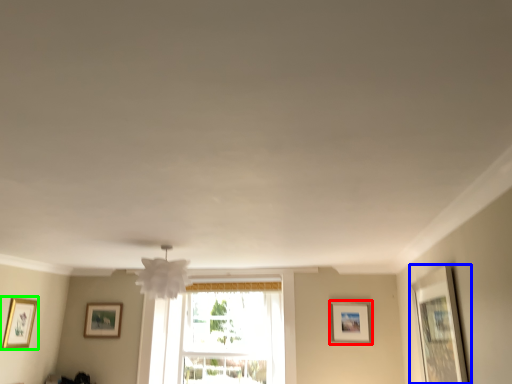
Question: Which object is positioned farthest from picture frame (highlighted by a red box)? Select from picture frame (highlighted by a blue box) and picture frame (highlighted by a green box).

Choices:
 (A) picture frame
 (B) picture frame

Answer: (B)